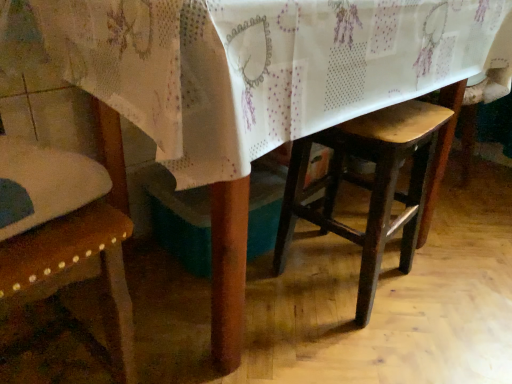
At what (x,y) coordinates should I click in order to perform the action: click on vacant space to the right of wooden stool at center. Please return your answer as a coordinate pair (x, y). Image resolution: width=512 pixels, height=384 pixels. Looking at the image, I should click on (448, 288).